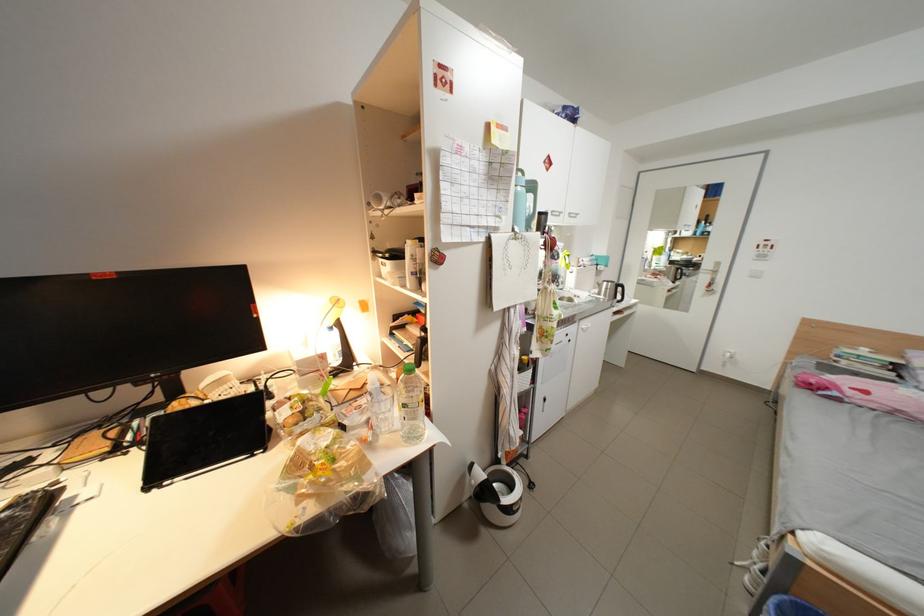
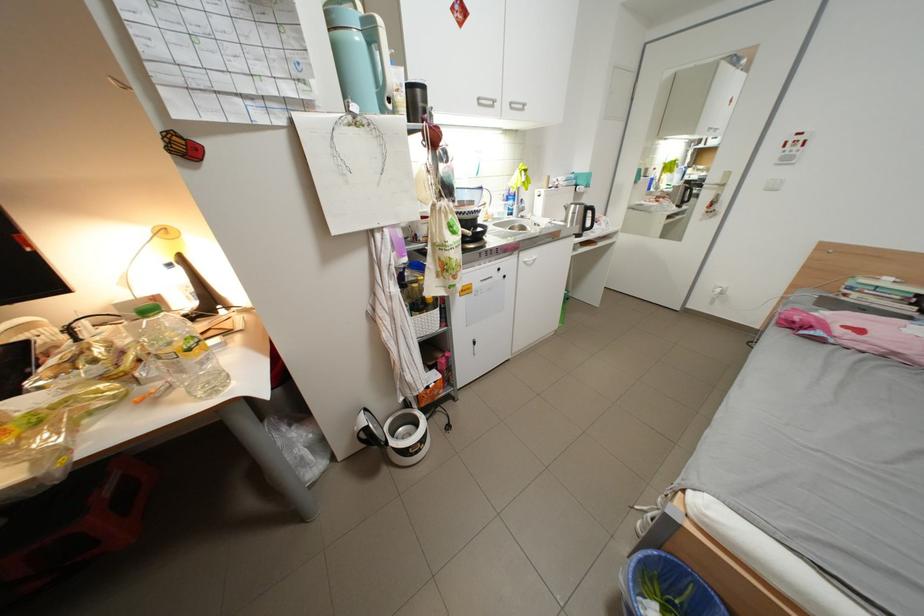
Find the pixel in the second image that matches (528,230) in the first image.

(367, 108)